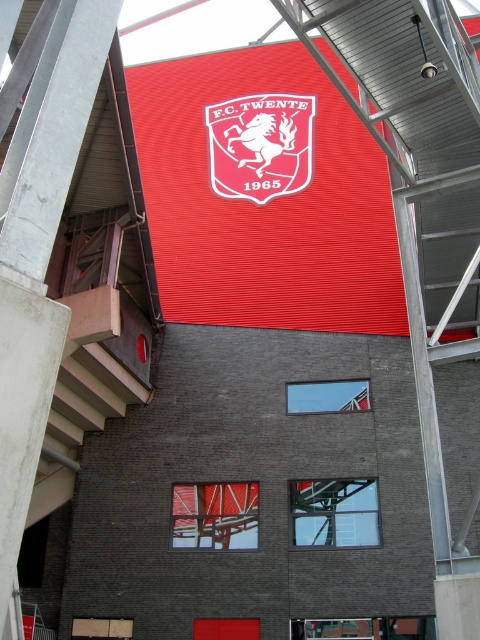
Question: Among these objects, which one is farthest from the camera?

Choices:
 (A) matte red shield at center
 (B) red matte flag at center

Answer: (A)

Question: Which point is farther from the camera taking this photo?

Choices:
 (A) (362, 387)
 (B) (300, 161)

Answer: (B)

Question: In this image, where is matte red shield at center located relative to red matte flag at center?

Choices:
 (A) above
 (B) below

Answer: (A)

Question: Does matte red shield at center have a larger size compared to red matte flag at center?

Choices:
 (A) no
 (B) yes

Answer: (B)

Question: Does matte red shield at center have a greater width compared to red matte flag at center?

Choices:
 (A) yes
 (B) no

Answer: (A)